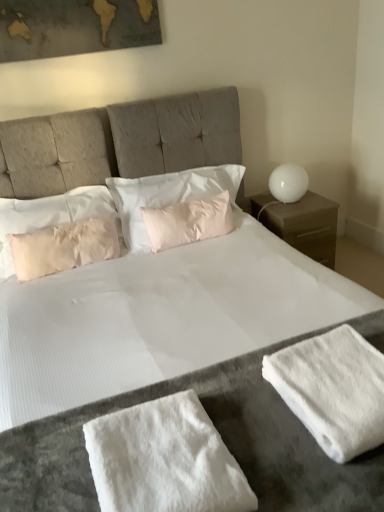
Question: Which is correct: white fluffy towel at lower center is inside white matte nightstand at right, or outside of it?

Choices:
 (A) outside
 (B) inside

Answer: (A)

Question: Considering the positions of point (99, 437) and point (307, 195), is point (99, 437) closer or farther from the camera than point (307, 195)?

Choices:
 (A) farther
 (B) closer

Answer: (B)

Question: Considering the real-world distances, which object is closest to the white matte table lamp at right?

Choices:
 (A) pink fabric pillow at upper left, which is the first pillow in left-to-right order
 (B) pink satin pillow at center, which is the 2th pillow from left to right
 (C) white fluffy bath towel at lower right
 (D) white fluffy towel at lower center
 (E) pink textured pillow at center, the first pillow when ordered from right to left

Answer: (B)

Question: Considering the real-world distances, which object is farthest from the white matte nightstand at right?

Choices:
 (A) pink textured pillow at center, the first pillow when ordered from right to left
 (B) pink satin pillow at center, the second pillow viewed from the right
 (C) white fluffy towel at lower center
 (D) white fluffy bath towel at lower right
 (E) white matte table lamp at right

Answer: (C)